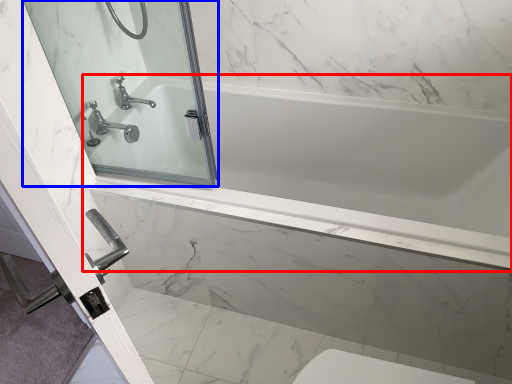
Question: Which object is closer to the camera taking this photo, bathtub (highlighted by a red box) or mirror (highlighted by a blue box)?

Choices:
 (A) bathtub
 (B) mirror

Answer: (B)